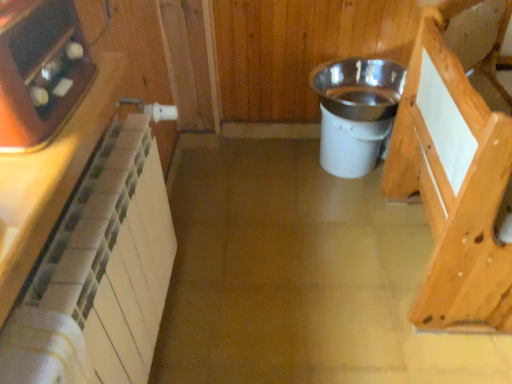
Identify the location of free space in front of white plastic bucket at center, the second appliance in the left-to-right sequence. (356, 213).